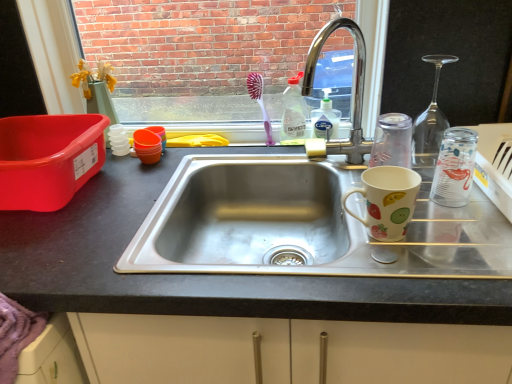
This screenshot has height=384, width=512. Identify the location of pink plastic toothbrush at upper center. (260, 102).

At what (x,y) coordinates should I click in order to perform the action: click on chrome/metallic faucet at upper center. Please return your answer as a coordinate pair (x, y). Looking at the image, I should click on (353, 88).

I want to click on matte ceramic mug at right, so point(387,201).

Measure the distance between matte ceramic mug at right and camera.

They are 27.48 inches apart.

Image resolution: width=512 pixels, height=384 pixels. Describe the element at coordinates (48, 158) in the screenshot. I see `matte plastic container at left` at that location.

This screenshot has height=384, width=512. What do you see at coordinates (454, 168) in the screenshot?
I see `transparent glass bottle at right, which is counted as the second bottle, starting from the left` at bounding box center [454, 168].

I want to click on pink plastic toothbrush at upper center, so click(x=260, y=102).

From the image's perspective, relative to matte plastic container at left, is matte black sink at center above or below?

Clearly, from the image's perspective, matte black sink at center is below matte plastic container at left.

Does point (434, 303) lie in front of point (25, 146)?

Yes, point (434, 303) is in front of point (25, 146).

Is matte black sink at center directly adjacent to matte plastic container at left?

matte black sink at center and matte plastic container at left are not in contact.

What's the angular difference between transparent glass bottle at right, the second bottle positioned from the back, and translucent plastic bottle at upper center, arranged as the 2th bottle when ordered from the bottom,'s facing directions?

There is a 3.41-degree angle between the facing directions of transparent glass bottle at right, the second bottle positioned from the back, and translucent plastic bottle at upper center, arranged as the 2th bottle when ordered from the bottom.

In the scene shown: From the image's perspective, which is above, transparent glass bottle at right, marked as the first bottle in a bottom-to-top arrangement, or translucent plastic bottle at upper center, arranged as the 2th bottle when viewed from the right?

translucent plastic bottle at upper center, arranged as the 2th bottle when viewed from the right.

Consider the image. Does transparent glass bottle at right, marked as the first bottle in a bottom-to-top arrangement, have a lesser width compared to translucent plastic bottle at upper center, acting as the first bottle starting from the top?

No.

Do you think transparent glass bottle at right, which is the first bottle in front-to-back order, is within translucent plastic bottle at upper center, arranged as the 2th bottle when ordered from the bottom, or outside of it?

transparent glass bottle at right, which is the first bottle in front-to-back order, cannot be found inside translucent plastic bottle at upper center, arranged as the 2th bottle when ordered from the bottom.

Who is smaller, translucent plastic bottle at upper center, arranged as the 2th bottle when viewed from the right, or pink plastic toothbrush at upper center?

pink plastic toothbrush at upper center.

Is pink plastic toothbrush at upper center a part of translucent plastic bottle at upper center, arranged as the 2th bottle when ordered from the bottom?

No, translucent plastic bottle at upper center, arranged as the 2th bottle when ordered from the bottom, does not contain pink plastic toothbrush at upper center.

Is translucent plastic bottle at upper center, arranged as the 2th bottle when ordered from the bottom, oriented away from pink plastic toothbrush at upper center?

No, translucent plastic bottle at upper center, arranged as the 2th bottle when ordered from the bottom,'s orientation is not away from pink plastic toothbrush at upper center.

You are a GUI agent. You are given a task and a screenshot of the screen. Output one action in this format:
    pyautogui.click(x=<x>, y=<y>)
    Task: Click on the toothbrush lying in front of the translucent plastic bottle at upper center, acting as the first bottle starting from the top
    
    Given the screenshot: What is the action you would take?
    pyautogui.click(x=260, y=102)

Could you tell me if pink plastic toothbrush at upper center is facing matte ceramic mug at right?

No, pink plastic toothbrush at upper center does not turn towards matte ceramic mug at right.

Considering the relative sizes of pink plastic toothbrush at upper center and matte ceramic mug at right in the image provided, is pink plastic toothbrush at upper center taller than matte ceramic mug at right?

Yes, pink plastic toothbrush at upper center is taller than matte ceramic mug at right.

Is pink plastic toothbrush at upper center with matte ceramic mug at right?

pink plastic toothbrush at upper center is not next to matte ceramic mug at right, and they're not touching.

What's the angular difference between pink plastic toothbrush at upper center and matte ceramic mug at right's facing directions?

3.41 degrees.

From the image's perspective, which is below, transparent glass bottle at right, which is the first bottle in right-to-left order, or pink plastic toothbrush at upper center?

transparent glass bottle at right, which is the first bottle in right-to-left order, from the image's perspective.

How many degrees apart are the facing directions of transparent glass bottle at right, which is the first bottle in right-to-left order, and pink plastic toothbrush at upper center?

transparent glass bottle at right, which is the first bottle in right-to-left order, and pink plastic toothbrush at upper center are facing 3.41 degrees away from each other.

Relative to pink plastic toothbrush at upper center, is transparent glass bottle at right, marked as the 2th bottle in a top-to-bottom arrangement, in front or behind?

In the image, transparent glass bottle at right, marked as the 2th bottle in a top-to-bottom arrangement, appears in front of pink plastic toothbrush at upper center.

Between point (444, 139) and point (249, 84), which one is positioned behind?

The point (249, 84) is farther.

Which object is positioned more to the left, matte black sink at center or pink plastic toothbrush at upper center?

From the viewer's perspective, pink plastic toothbrush at upper center appears more on the left side.

Do you think matte black sink at center is within pink plastic toothbrush at upper center, or outside of it?

matte black sink at center is not inside pink plastic toothbrush at upper center, it's outside.

Which of these two, matte black sink at center or pink plastic toothbrush at upper center, is wider?

With larger width is matte black sink at center.

From the image's perspective, which is below, matte black sink at center or pink plastic toothbrush at upper center?

matte black sink at center, from the image's perspective.

Is point (106, 304) positioned in front of point (294, 83)?

Yes, it is.

In terms of size, does matte black sink at center appear bigger or smaller than translucent plastic bottle at upper center, acting as the first bottle starting from the top?

Considering their sizes, matte black sink at center takes up more space than translucent plastic bottle at upper center, acting as the first bottle starting from the top.

What are the coordinates of `desk below the translucent plastic bottle at upper center, the 2th bottle viewed from the front (from the image's perspective)` in the screenshot? It's located at (203, 274).

Would you say translucent plastic bottle at upper center, which is the 1th bottle from left to right, is part of matte black sink at center's contents?

No.

The width and height of the screenshot is (512, 384). Find the location of `desk below the matte plastic container at left (from the image's perspective)`. desk below the matte plastic container at left (from the image's perspective) is located at coordinates (203, 274).

Where is `bottle above the transparent glass bottle at right, which is the first bottle in front-to-back order (from a real-world perspective)`? bottle above the transparent glass bottle at right, which is the first bottle in front-to-back order (from a real-world perspective) is located at coordinates (293, 114).

Which object lies nearer to the anchor point matte black sink at center, chrome/metallic faucet at upper center or pink plastic toothbrush at upper center?

chrome/metallic faucet at upper center lies closer to matte black sink at center than the other object.

Based on their spatial positions, is chrome/metallic faucet at upper center or pink plastic toothbrush at upper center closer to transparent glass bottle at right, which is the first bottle in front-to-back order?

Based on the image, chrome/metallic faucet at upper center appears to be nearer to transparent glass bottle at right, which is the first bottle in front-to-back order.

When comparing their distances from matte ceramic mug at right, does matte plastic container at left or chrome/metallic faucet at upper center seem further?

Among the two, matte plastic container at left is located further to matte ceramic mug at right.

Which object lies nearer to the anchor point translucent plastic bottle at upper center, which is the 1th bottle from left to right, matte black sink at center or matte ceramic mug at right?

matte ceramic mug at right.

Based on their spatial positions, is matte black sink at center or chrome/metallic faucet at upper center closer to transparent glass bottle at right, marked as the 2th bottle in a top-to-bottom arrangement?

chrome/metallic faucet at upper center is positioned closer to the anchor transparent glass bottle at right, marked as the 2th bottle in a top-to-bottom arrangement.

When comparing their distances from matte ceramic mug at right, does matte plastic container at left or translucent plastic bottle at upper center, the 1th bottle viewed from the back, seem further?

Based on the image, matte plastic container at left appears to be further to matte ceramic mug at right.

Estimate the real-world distances between objects in this image. Which object is further from matte ceramic mug at right, matte plastic container at left or transparent glass bottle at right, the second bottle positioned from the back?

Based on the image, matte plastic container at left appears to be further to matte ceramic mug at right.

Which object lies further to the anchor point matte plastic container at left, transparent glass bottle at right, which is the first bottle in right-to-left order, or pink plastic toothbrush at upper center?

Among the two, transparent glass bottle at right, which is the first bottle in right-to-left order, is located further to matte plastic container at left.

Find the location of `coffee cup between chrome/metallic faucet at upper center and transparent glass bottle at right, which is the first bottle in right-to-left order, from left to right`. coffee cup between chrome/metallic faucet at upper center and transparent glass bottle at right, which is the first bottle in right-to-left order, from left to right is located at coordinates (387, 201).

The image size is (512, 384). What are the coordinates of `bottle between matte ceramic mug at right and translucent plastic bottle at upper center, acting as the first bottle starting from the top, from front to back` in the screenshot? It's located at (454, 168).

Identify the location of toothbrush situated between matte plastic container at left and translucent plastic bottle at upper center, arranged as the 2th bottle when viewed from the right, from left to right. pos(260,102).

This screenshot has width=512, height=384. I want to click on bottle between matte plastic container at left and matte ceramic mug at right, so [x=293, y=114].